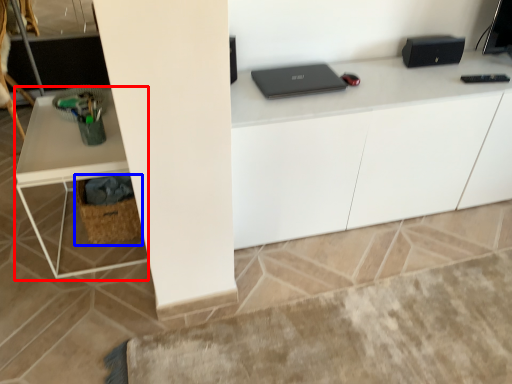
Question: Which point is closer to the camera, computer desk (highlighted by a red box) or basket (highlighted by a blue box)?

Choices:
 (A) computer desk
 (B) basket

Answer: (A)